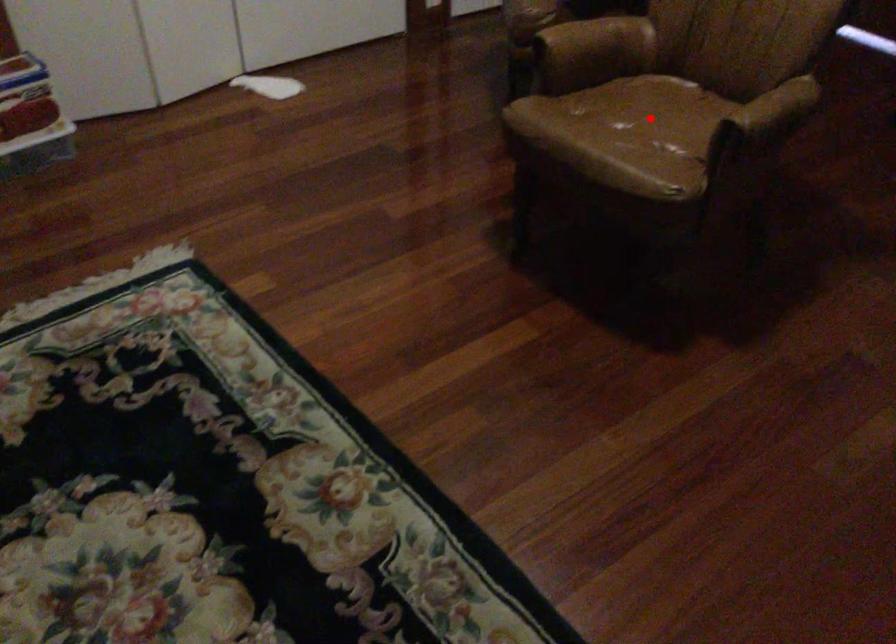
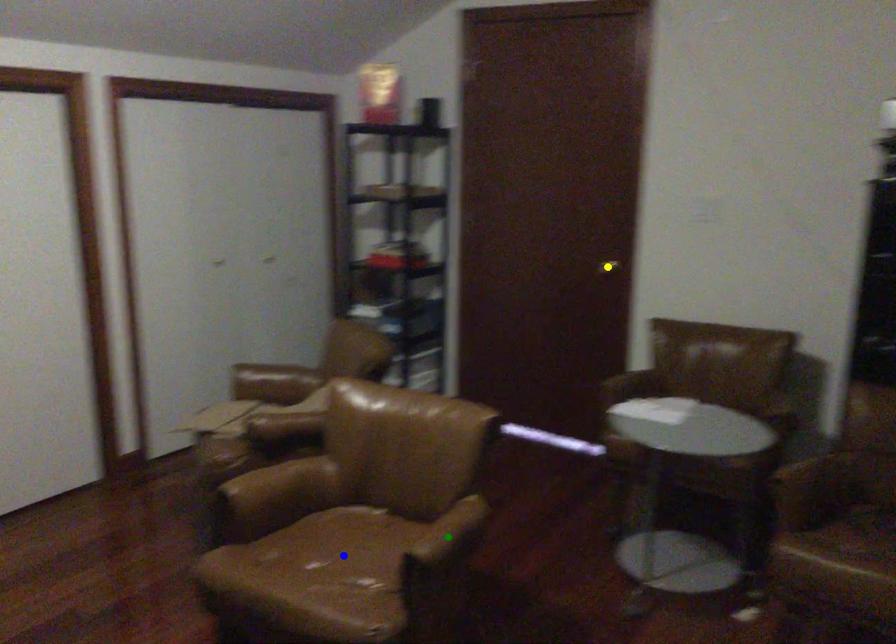
Question: I am providing you with two images of the same scene from different viewpoints. A red point is marked on the first image. You are given multiple points on the second image. Which mark in image 2 goes with the point in image 1?

Choices:
 (A) blue point
 (B) yellow point
 (C) green point

Answer: (A)